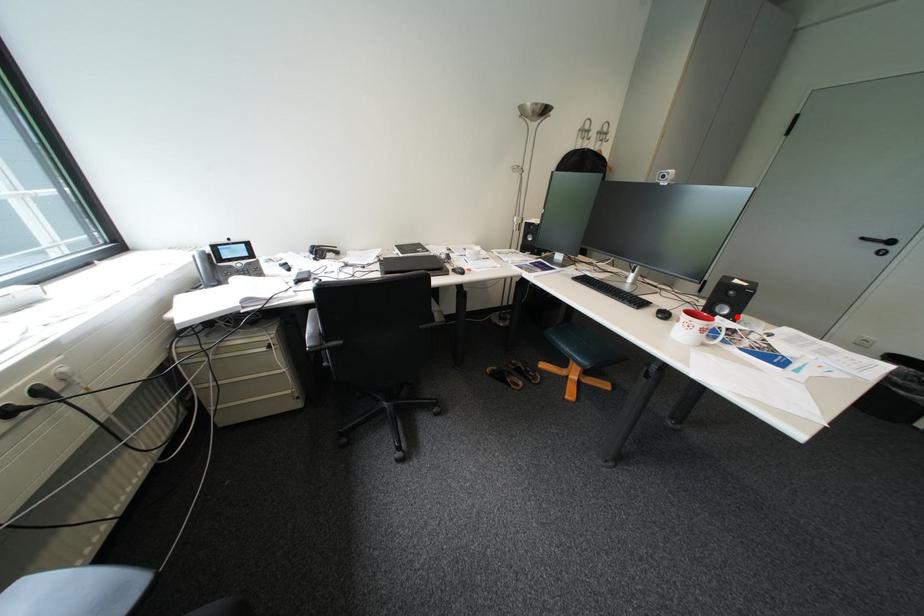
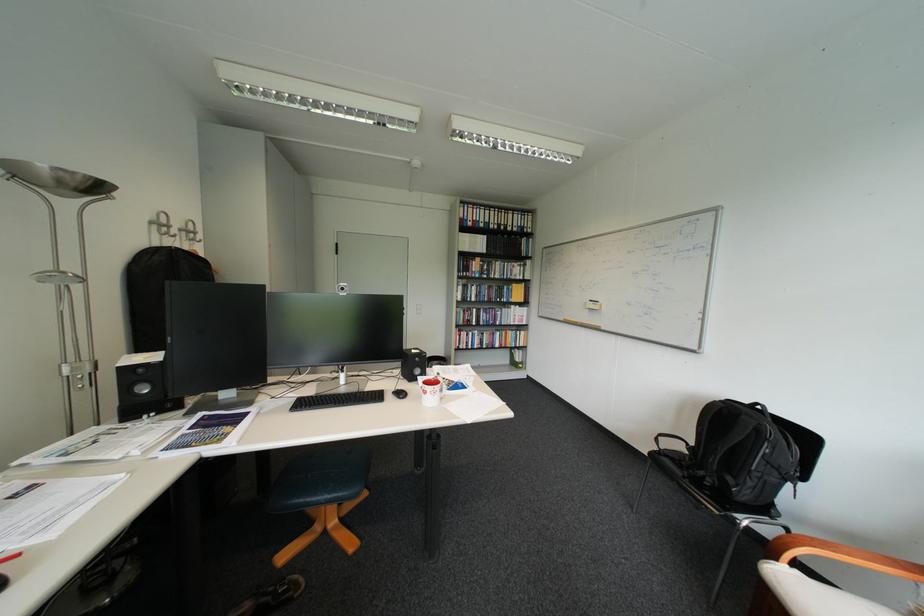
Question: I am providing you with two images of the same scene from different viewpoints. In image1, a red point is highlighted. Considering the same 3D point in image2, which of the following is correct?

Choices:
 (A) It is closer
 (B) It is farther

Answer: (A)